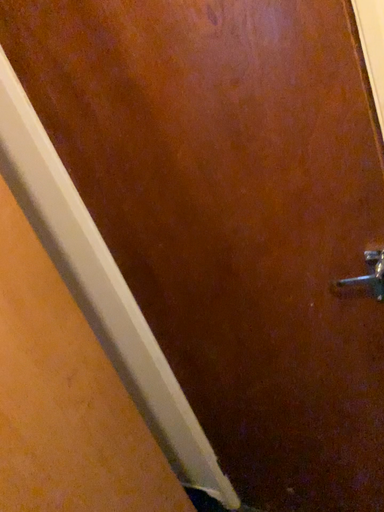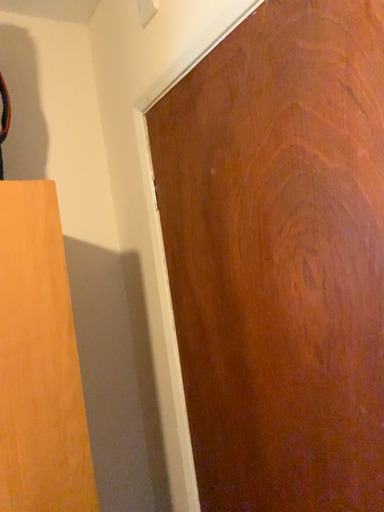
Question: How did the camera likely rotate when shooting the video?

Choices:
 (A) rotated downward
 (B) rotated upward

Answer: (B)